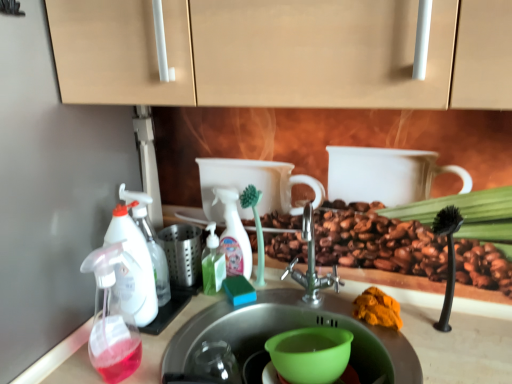
You are a GUI agent. You are given a task and a screenshot of the screen. Output one action in this format:
    pyautogui.click(x=<x>, y=<y>)
    Task: Click on the free area in between green translucent soap dispenser at center, which is the first soap dispenser from back to front, and orange powder at sink
    
    Given the screenshot: What is the action you would take?
    pyautogui.click(x=304, y=302)